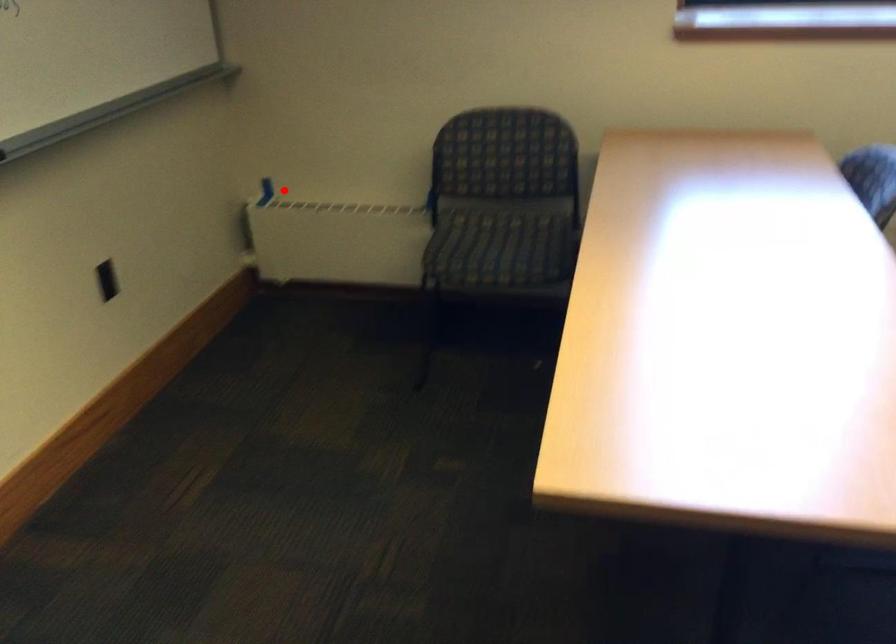
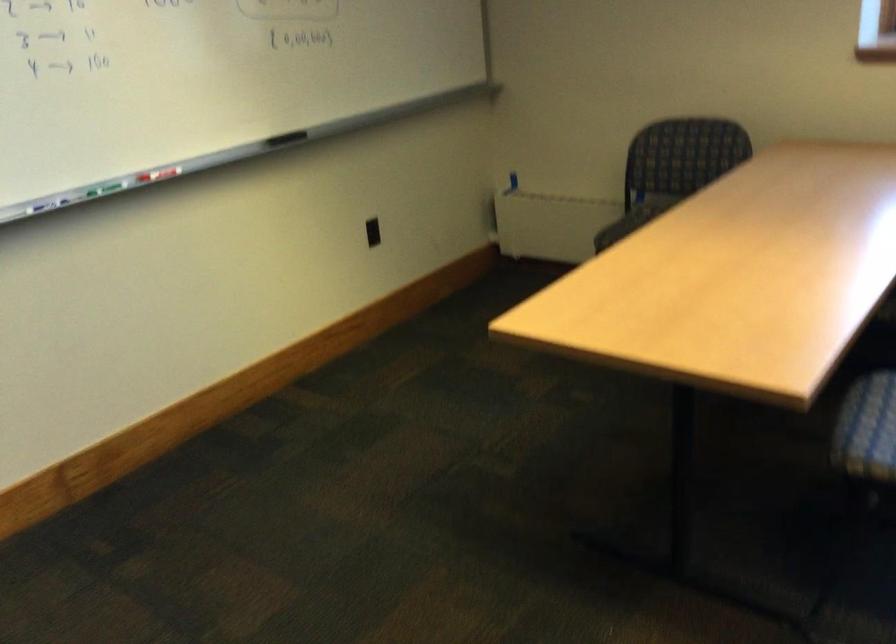
Question: I am providing you with two images of the same scene from different viewpoints. A red point is shown in image1. For the corresponding object point in image2, is it positioned nearer or farther from the camera?

Choices:
 (A) Nearer
 (B) Farther

Answer: (B)